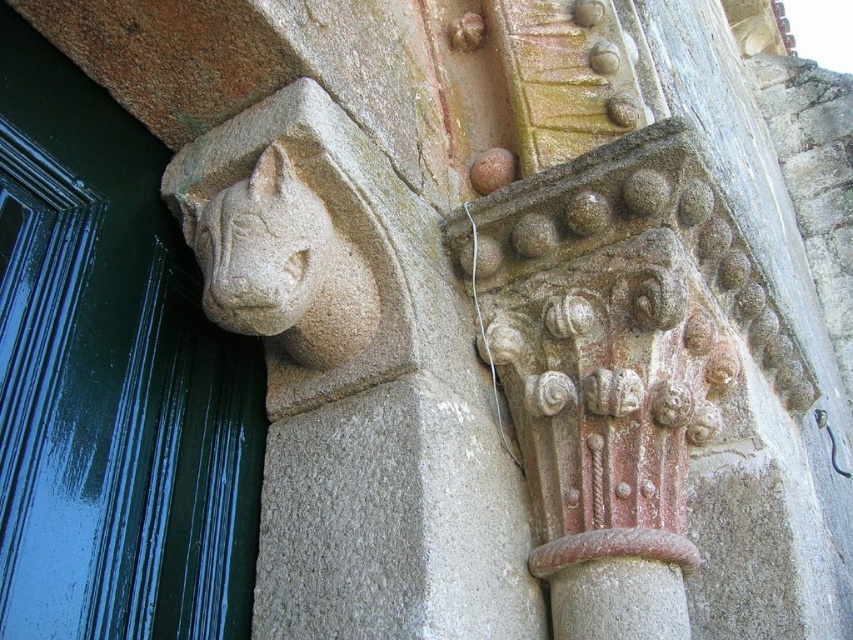
Who is taller, gray stone lion head at upper left or stone carved gargoyle at upper left?

Standing taller between the two is gray stone lion head at upper left.

Between gray stone lion head at upper left and stone carved gargoyle at upper left, which one is positioned higher?

stone carved gargoyle at upper left is higher up.

Measure the distance between gray stone lion head at upper left and camera.

They are 3.72 feet apart.

The height and width of the screenshot is (640, 853). I want to click on gray stone lion head at upper left, so click(355, 385).

Is green glossy door at left further to the viewer compared to stone carved gargoyle at upper left?

No, green glossy door at left is closer to the viewer.

Which is above, green glossy door at left or stone carved gargoyle at upper left?

Positioned higher is stone carved gargoyle at upper left.

Where is `green glossy door at left`? This screenshot has width=853, height=640. green glossy door at left is located at coordinates (111, 381).

Which of these two, gray stone lion head at upper left or green glossy door at left, stands shorter?

Standing shorter between the two is gray stone lion head at upper left.

Between point (430, 273) and point (86, 355), which one is positioned behind?

Positioned behind is point (430, 273).

Locate an element on the screen. Image resolution: width=853 pixels, height=640 pixels. gray stone lion head at upper left is located at coordinates (355, 385).